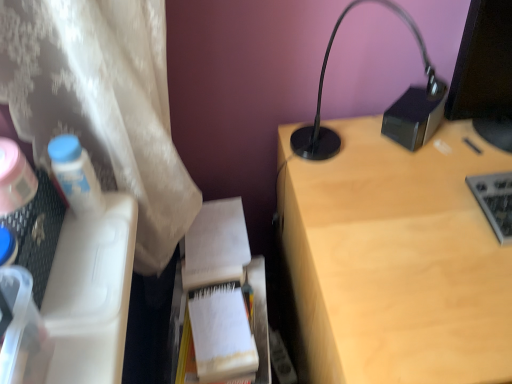
This screenshot has width=512, height=384. Find the location of `vacant location below black glossy monitor at upper right (from a real-world perspective)`. vacant location below black glossy monitor at upper right (from a real-world perspective) is located at coordinates (478, 133).